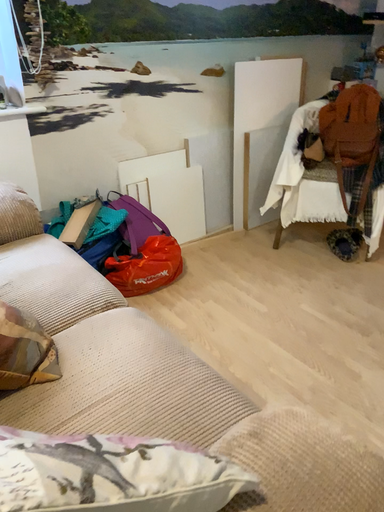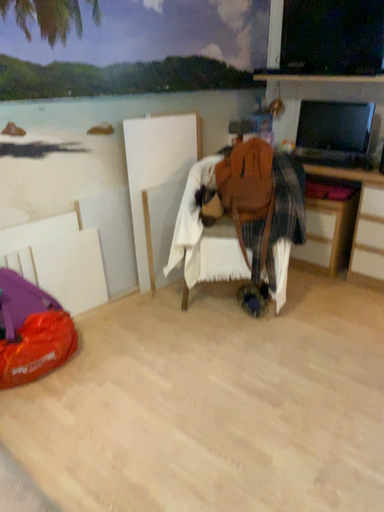
Question: Which way did the camera rotate in the video?

Choices:
 (A) rotated left
 (B) rotated right

Answer: (B)